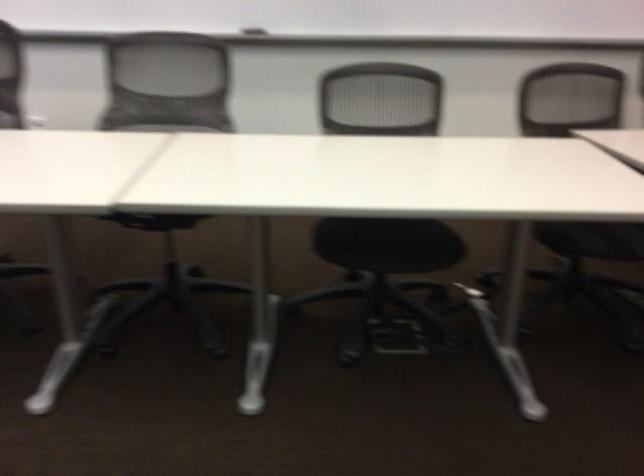
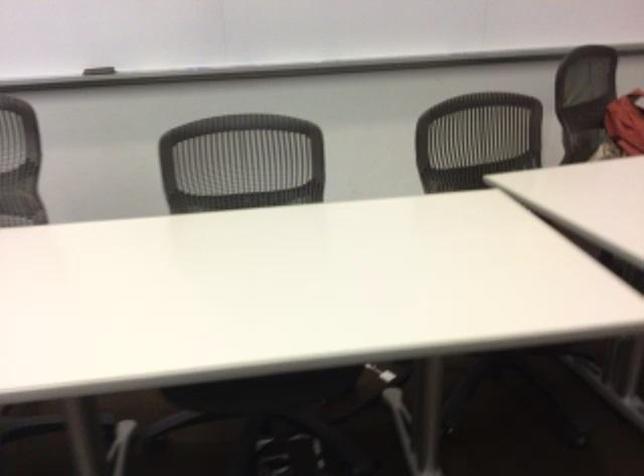
Question: How did the camera likely rotate?

Choices:
 (A) Left
 (B) Right
 (C) Up
 (D) Down

Answer: (B)